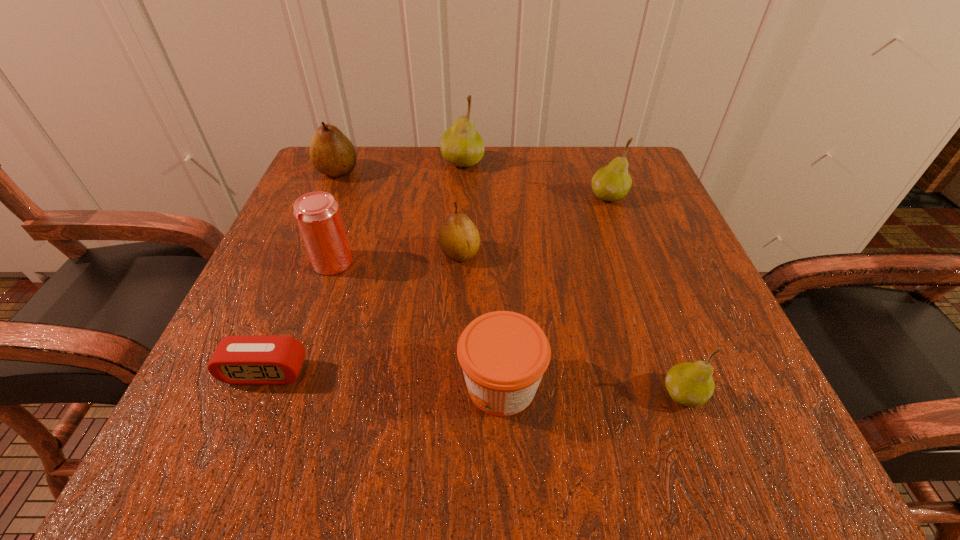
Locate an element on the screen. Image resolution: width=960 pixels, height=540 pixels. free spot located on the front label of the jam is located at coordinates (365, 386).

The height and width of the screenshot is (540, 960). In order to click on vacant space located on the front label of the jam in this screenshot , I will do `click(322, 386)`.

Where is `blank area located on the front label of the jam`? This screenshot has width=960, height=540. blank area located on the front label of the jam is located at coordinates (285, 386).

You are a GUI agent. You are given a task and a screenshot of the screen. Output one action in this format:
    pyautogui.click(x=<x>, y=<y>)
    Task: Click on the pear located in the near edge section of the desktop
    
    Given the screenshot: What is the action you would take?
    pyautogui.click(x=690, y=384)

What are the coordinates of `jam positioned at the near edge` in the screenshot? It's located at (503, 354).

Locate an element on the screen. pear present at the left edge is located at coordinates (331, 152).

In order to click on beer can that is at the left edge in this screenshot , I will do `click(317, 214)`.

This screenshot has height=540, width=960. I want to click on alarm clock present at the left edge, so click(x=245, y=359).

Find the location of `object that is positioned at the far left corner`. object that is positioned at the far left corner is located at coordinates (331, 152).

You are a GUI agent. You are given a task and a screenshot of the screen. Output one action in this format:
    pyautogui.click(x=<x>, y=<y>)
    Task: Click on the object that is at the far right corner
    This screenshot has height=540, width=960.
    Given the screenshot: What is the action you would take?
    [x=612, y=182]